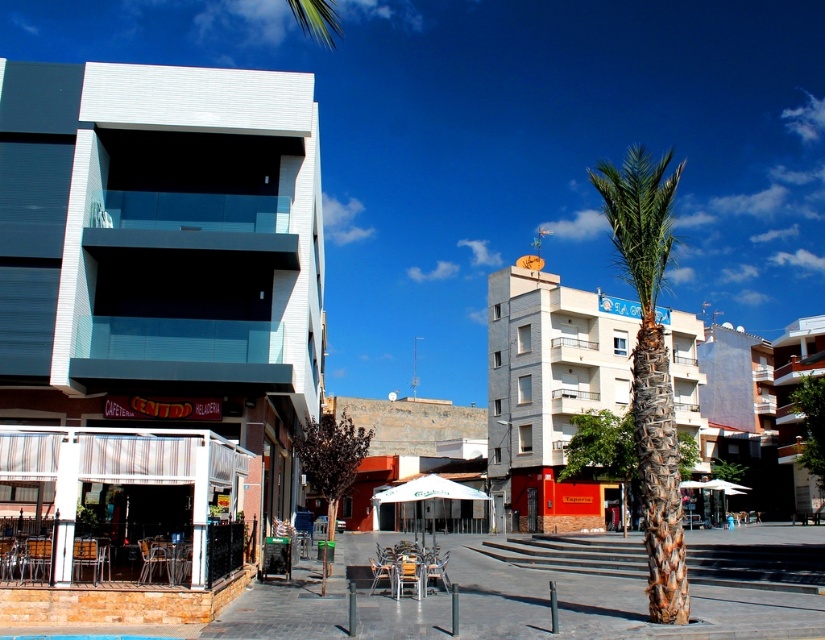
You are standing in front of the modern building and want to take a photo of both the point at coordinates (297, 195) and the point at (785, 429). Which point will appear larger in your camera view?

The point at coordinates (297, 195) will appear larger in the camera view because it is closer to the camera than the point at (785, 429).